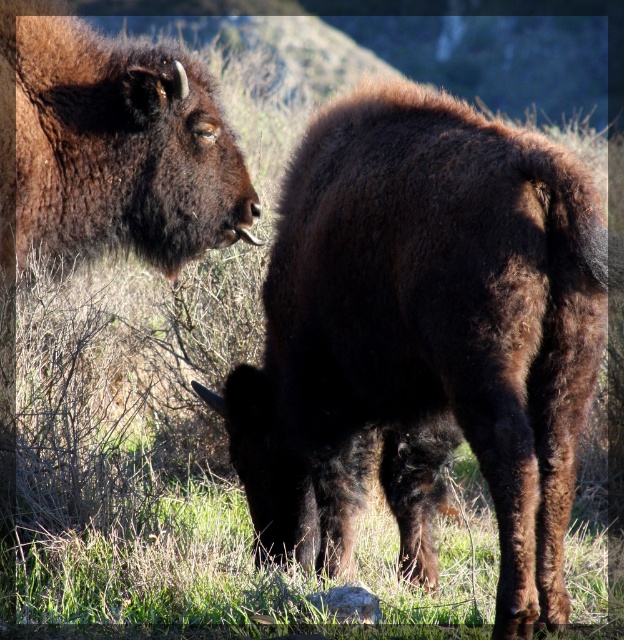
Question: Which object is farther from the camera taking this photo?

Choices:
 (A) dark brown fur at center
 (B) dark brown fur at upper left

Answer: (B)

Question: Where is dark brown fur at center located in relation to dark brown fur at upper left in the image?

Choices:
 (A) left
 (B) right

Answer: (B)

Question: Does dark brown fur at center have a lesser width compared to dark brown fur at upper left?

Choices:
 (A) no
 (B) yes

Answer: (A)

Question: Is dark brown fur at center thinner than dark brown fur at upper left?

Choices:
 (A) no
 (B) yes

Answer: (A)

Question: Which point appears closest to the camera in this image?

Choices:
 (A) (94, 240)
 (B) (431, 512)

Answer: (A)